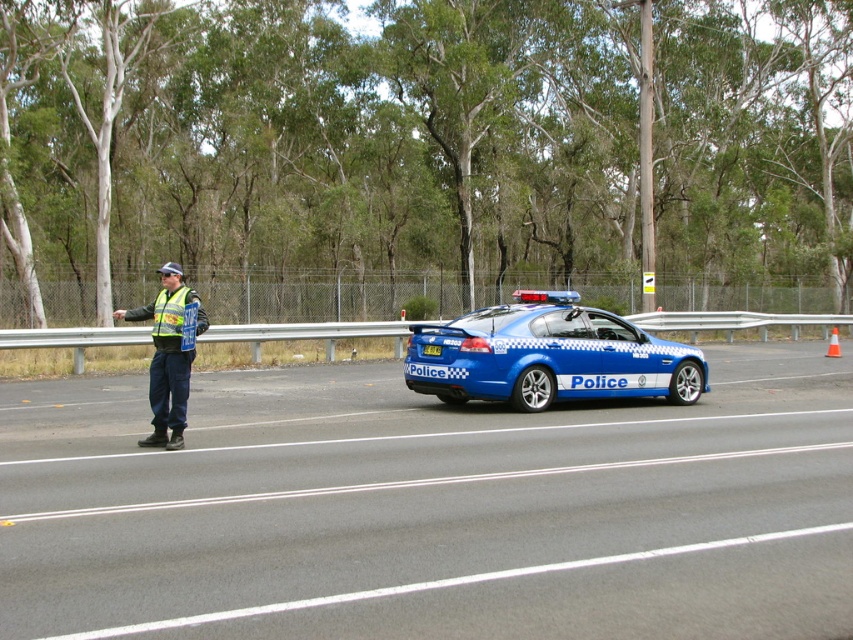
Question: Does asphalt road at center have a greater width compared to reflective yellow vest at left?

Choices:
 (A) yes
 (B) no

Answer: (A)

Question: Which object is the farthest from the reflective yellow vest at left?

Choices:
 (A) asphalt road at center
 (B) metallic gray barrier at center
 (C) blue metallic police car at center

Answer: (B)

Question: Does blue metallic police car at center appear on the left side of reflective yellow vest at left?

Choices:
 (A) yes
 (B) no

Answer: (B)

Question: Which point is farther from the camera taking this photo?

Choices:
 (A) (630, 317)
 (B) (436, 348)

Answer: (A)

Question: Is blue metallic police car at center thinner than metallic gray barrier at center?

Choices:
 (A) yes
 (B) no

Answer: (A)

Question: Which point is farther to the camera?

Choices:
 (A) blue metallic police car at center
 (B) reflective yellow vest at left

Answer: (A)